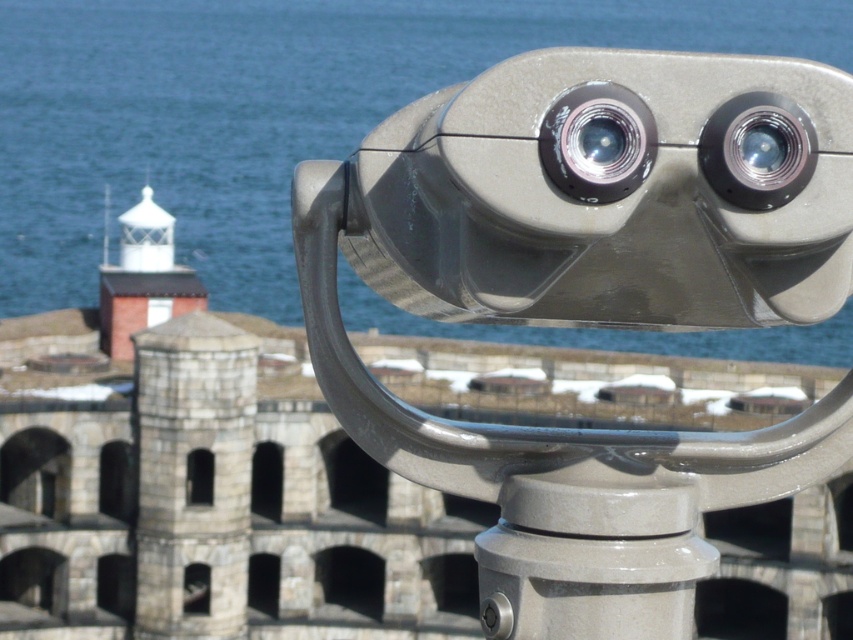
Question: Is satin silver telescope at center to the left of matte metallic lens at center from the viewer's perspective?

Choices:
 (A) yes
 (B) no

Answer: (B)

Question: Can you confirm if blue water at upper center is positioned above matte silver lens at upper right?

Choices:
 (A) no
 (B) yes

Answer: (B)

Question: Which point appears closest to the camera in this image?

Choices:
 (A) (705, 152)
 (B) (567, 144)
 (C) (647, 456)

Answer: (B)

Question: Is satin silver telescope at center in front of matte silver lens at upper right?

Choices:
 (A) yes
 (B) no

Answer: (A)

Question: Considering the real-world distances, which object is closest to the blue water at upper center?

Choices:
 (A) matte silver lens at upper right
 (B) matte metallic lens at center

Answer: (B)

Question: Which of these objects is positioned closest to the matte metallic lens at center?

Choices:
 (A) blue water at upper center
 (B) matte silver lens at upper right
 (C) satin silver telescope at center

Answer: (B)